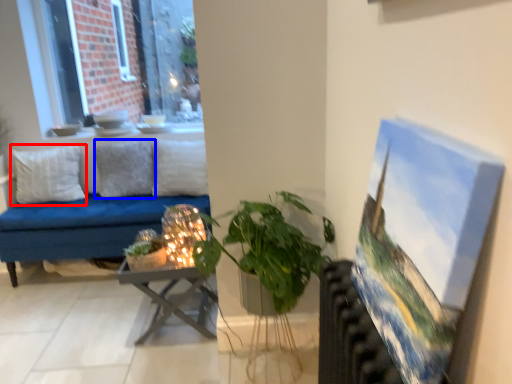
Question: Which point is closer to the camera, pillow (highlighted by a red box) or pillow (highlighted by a blue box)?

Choices:
 (A) pillow
 (B) pillow

Answer: (A)